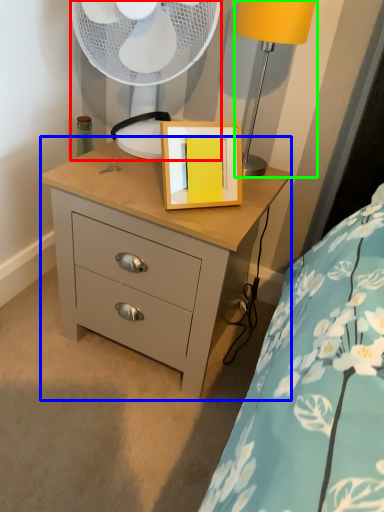
Question: Which is farther away from mechanical fan (highlighted by a red box)? chest of drawers (highlighted by a blue box) or table lamp (highlighted by a green box)?

Choices:
 (A) chest of drawers
 (B) table lamp

Answer: (A)